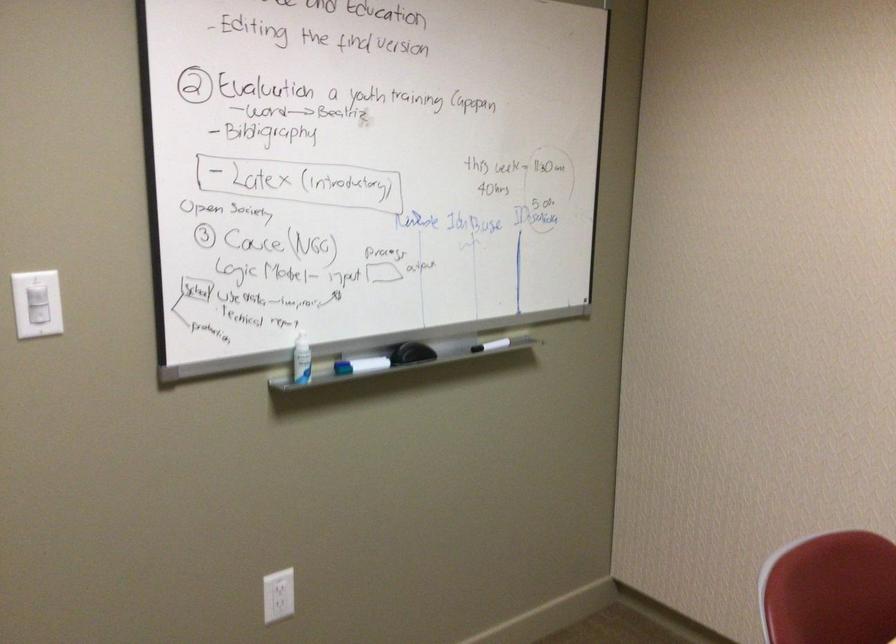
Image resolution: width=896 pixels, height=644 pixels. Identify the location of black whiteboard eraser. (410, 353).